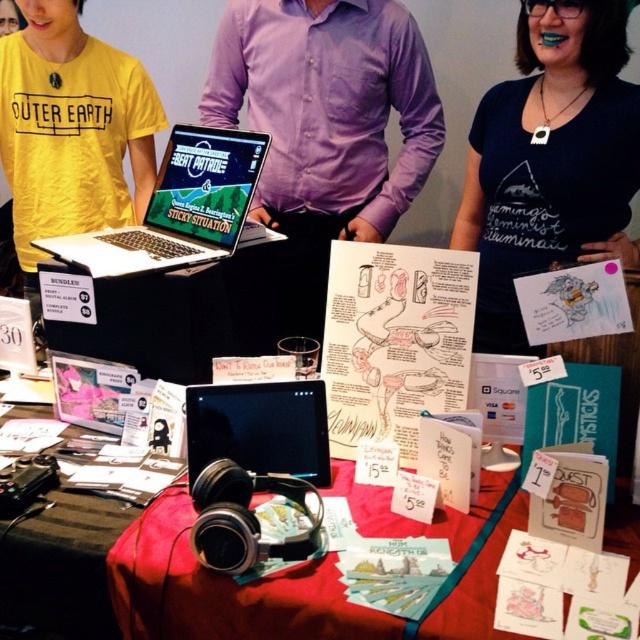
Question: Which object is farther from the camera taking this photo?

Choices:
 (A) purple cotton shirt at center
 (B) silver/black laptop at center
 (C) black matte tablet at center

Answer: (A)

Question: Which object is farther from the camera taking this photo?

Choices:
 (A) silver/black laptop at center
 (B) black matte tablet at center
 (C) matte blue t-shirt at center

Answer: (C)

Question: Is purple cotton shirt at center closer to camera compared to black matte tablet at center?

Choices:
 (A) yes
 (B) no

Answer: (B)

Question: Which object is the farthest from the purple cotton shirt at center?

Choices:
 (A) matte blue t-shirt at center
 (B) black matte tablet at center

Answer: (B)

Question: Can you confirm if purple cotton shirt at center is positioned to the right of matte blue t-shirt at center?

Choices:
 (A) no
 (B) yes

Answer: (A)

Question: Is black matte headphones at center bigger than silver/black laptop at center?

Choices:
 (A) no
 (B) yes

Answer: (B)